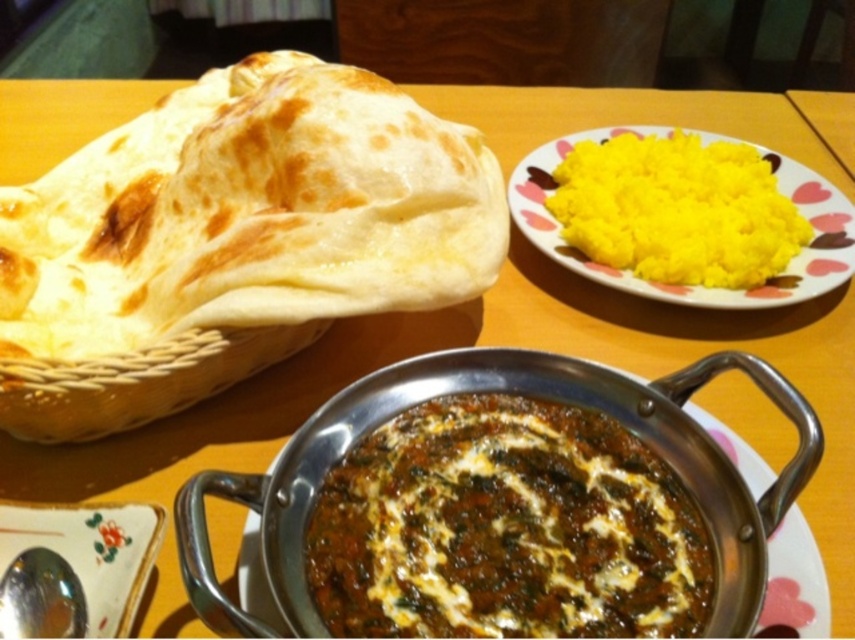
Question: Which object is closer to the camera taking this photo?

Choices:
 (A) yellow fluffy rice at upper right
 (B) brown matte curry at center
 (C) golden brown dough at left
 (D) metallic spoon at lower left

Answer: (B)

Question: Which point is farther to the camera?

Choices:
 (A) (12, 310)
 (B) (15, 524)
 (C) (626, 221)
 (D) (476, 429)

Answer: (C)

Question: Which is farther from the brown matte curry at center?

Choices:
 (A) golden brown dough at left
 (B) metallic spoon at lower left

Answer: (A)

Question: Is golden brown dough at left bigger than yellow fluffy rice at upper right?

Choices:
 (A) no
 (B) yes

Answer: (B)

Question: Is yellow fluffy rice at upper right behind metallic spoon at lower left?

Choices:
 (A) no
 (B) yes

Answer: (B)

Question: Considering the relative positions of brown matte curry at center and yellow fluffy rice at upper right in the image provided, where is brown matte curry at center located with respect to yellow fluffy rice at upper right?

Choices:
 (A) left
 (B) right

Answer: (A)